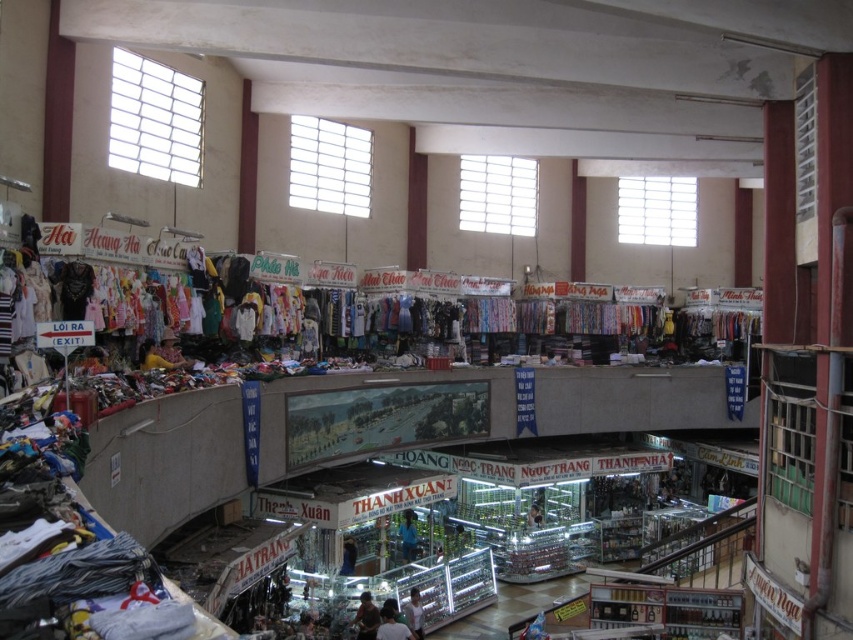
You are a customer at the market and want to buy a dress. You see a white fabric person at center and a dark blue fabric at center. Which one is closer to you?

The white fabric person at center is closer to you because it is located below the dark blue fabric at center, meaning it is positioned lower and nearer in the market layout.

You are a customer in the market and want to buy a light brown fabric shirt at lower center. You notice a white fabric person at center nearby. Which object is taller?

The white fabric person at center is taller than the light brown fabric shirt at lower center.